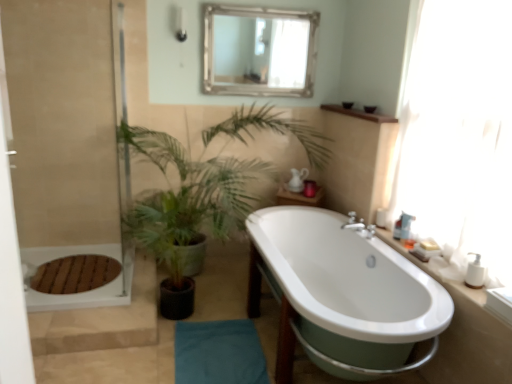
Question: Looking at the image, does white plastic pump bottle at right, which ranks as the first toiletry in front-to-back order, seem bigger or smaller compared to white glossy bathtub at center?

Choices:
 (A) big
 (B) small

Answer: (B)

Question: Considering the positions of white plastic pump bottle at right, the third toiletry when ordered from left to right, and white glossy bathtub at center in the image, is white plastic pump bottle at right, the third toiletry when ordered from left to right, wider or thinner than white glossy bathtub at center?

Choices:
 (A) wide
 (B) thin

Answer: (B)

Question: Estimate the real-world distances between objects in this image. Which object is farther from the white ceramic sink at right, which is counted as the 1th counter top, starting from the front?

Choices:
 (A) white plastic soap dispenser at right, the 1th toiletry viewed from the back
 (B) white plastic pump bottle at right, which ranks as the first toiletry in right-to-left order
 (C) beige textured screen door at left
 (D) green leafy plant at center
 (E) translucent plastic soap dispenser at right, marked as the 2th toiletry in a back-to-front arrangement

Answer: (C)

Question: Which object is the closest to the transparent glass window at right?

Choices:
 (A) white plastic soap dispenser at right, arranged as the 3th toiletry when viewed from the right
 (B) translucent plastic soap dispenser at right, which is the second toiletry in front-to-back order
 (C) matte white shower at upper left
 (D) green leafy plant at center
 (E) beige textured screen door at left

Answer: (B)